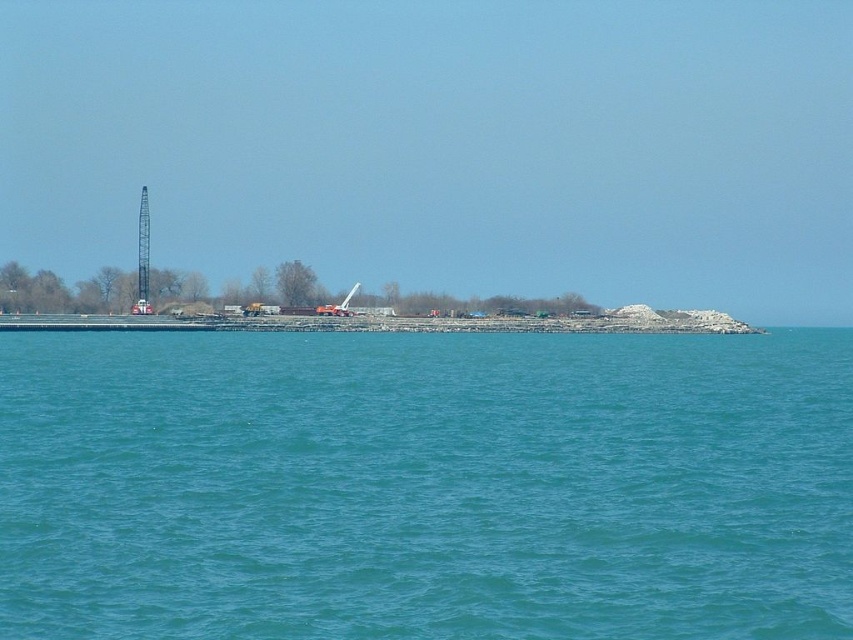
Can you confirm if metallic gray crane at left is taller than metallic crane at center?

Yes, metallic gray crane at left is taller than metallic crane at center.

Which is behind, point (142, 289) or point (329, 310)?

The point (142, 289) is more distant.

Where is `metallic gray crane at left`? metallic gray crane at left is located at coordinates (142, 257).

Which of these two, blue water at center or metallic gray crane at left, stands shorter?

blue water at center is shorter.

Who is more distant from viewer, (556, 456) or (143, 195)?

Positioned behind is point (143, 195).

Image resolution: width=853 pixels, height=640 pixels. Find the location of `blue water at center`. blue water at center is located at coordinates (425, 484).

Describe the element at coordinates (425, 484) in the screenshot. This screenshot has width=853, height=640. I see `blue water at center` at that location.

Measure the distance between blue water at center and metallic crane at center.

blue water at center and metallic crane at center are 170.50 feet apart from each other.

Between point (451, 390) and point (341, 305), which one is positioned behind?

The point (341, 305) is more distant.

Where is `blue water at center`? This screenshot has height=640, width=853. blue water at center is located at coordinates (425, 484).